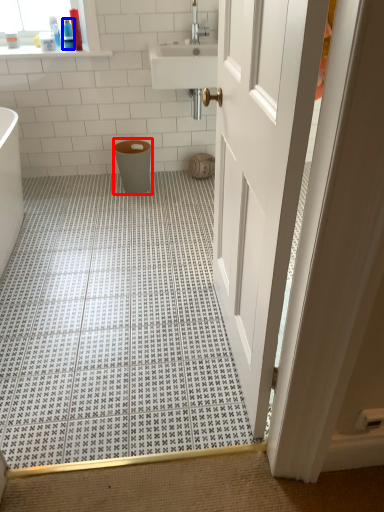
Question: Which point is further to the camera, toilet bowl (highlighted by a red box) or toiletry (highlighted by a blue box)?

Choices:
 (A) toilet bowl
 (B) toiletry

Answer: (B)